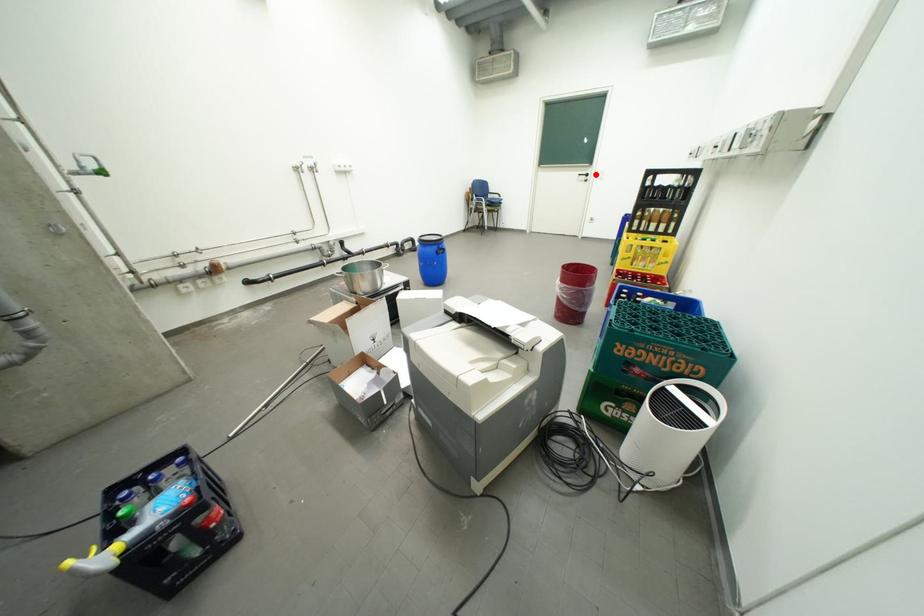
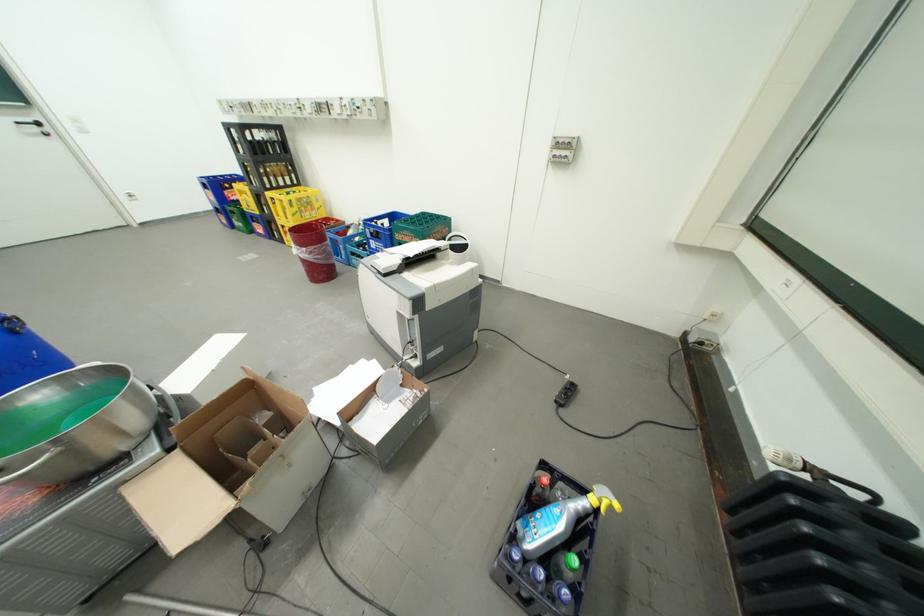
In the second image, find the point that corresponds to the highlighted location in the first image.

(41, 122)